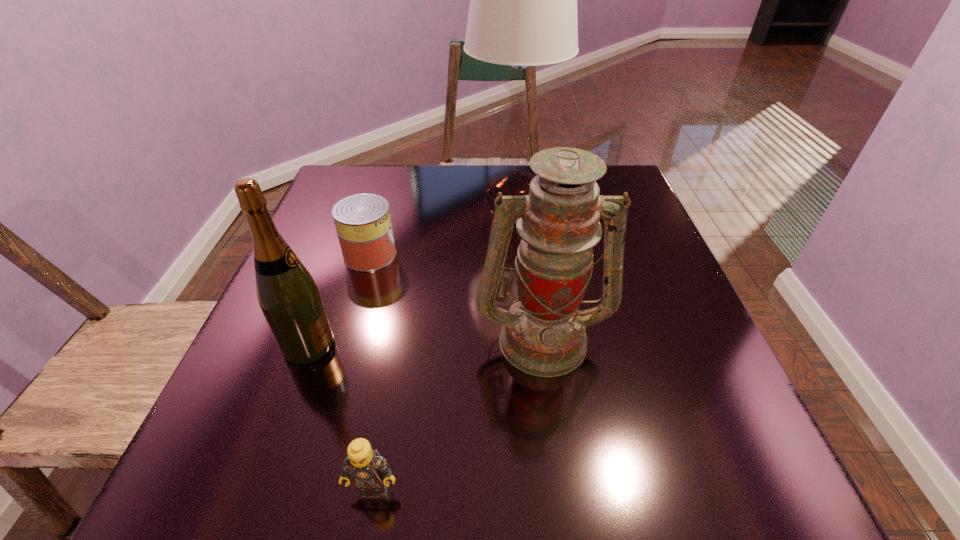
The width and height of the screenshot is (960, 540). In order to click on free space between the fourth nearest object and the wine bottle in this screenshot , I will do pos(339,300).

Locate an element on the screen. This screenshot has width=960, height=540. object that is the second closest to the third object from left to right is located at coordinates (288, 296).

Select which object is the second closest to the farthest object. Please provide its 2D coordinates. Your answer should be formatted as a tuple, i.e. [(x, y)], where the tuple contains the x and y coordinates of a point satisfying the conditions above.

[(543, 334)]

Locate an element on the screen. free location that satisfies the following two spatial constraints: 1. on the front-facing side of the tallest object; 2. on the front-facing side of the wine bottle is located at coordinates (529, 346).

Identify the location of free space that satisfies the following two spatial constraints: 1. on the front-facing side of the tallest object; 2. on the front-facing side of the wine bottle. The image size is (960, 540). (x=529, y=346).

Image resolution: width=960 pixels, height=540 pixels. I want to click on vacant region that satisfies the following two spatial constraints: 1. on the front-facing side of the table lamp; 2. on the right side of the oil lamp, so click(528, 338).